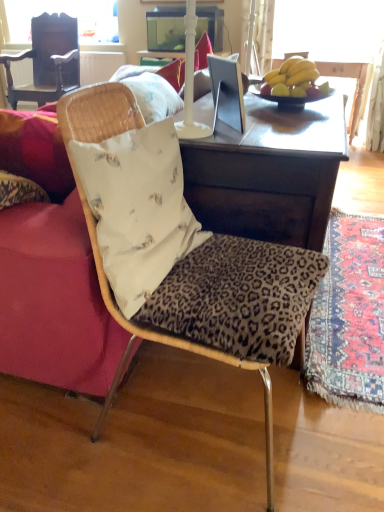
Question: In terms of width, does carpet with intricate patterns at lower right look wider or thinner when compared to velvet red couch at left?

Choices:
 (A) thin
 (B) wide

Answer: (A)

Question: Is point (350, 399) closer or farther from the camera than point (33, 252)?

Choices:
 (A) closer
 (B) farther

Answer: (B)

Question: Which object is positioned closest to the dark wood chair at upper left, the first chair from the back?

Choices:
 (A) white fabric pillow at center
 (B) velvet red couch at left
 (C) yellow matte bananas at upper right
 (D) wooden desk at center
 (E) carpet with intricate patterns at lower right

Answer: (C)

Question: Estimate the real-world distances between objects in this image. Which object is closer to the wooden desk at center?

Choices:
 (A) velvet red couch at left
 (B) leopard print fabric chair at center, marked as the second chair in a left-to-right arrangement
 (C) white fabric pillow at center
 (D) dark wood chair at upper left, the second chair in the right-to-left sequence
 (E) yellow matte bananas at upper right

Answer: (C)